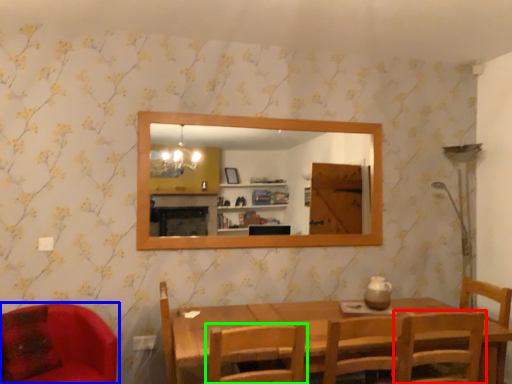
Question: Estimate the real-world distances between objects in this image. Which object is closer to chair (highlighted by a red box), chair (highlighted by a blue box) or chair (highlighted by a green box)?

Choices:
 (A) chair
 (B) chair

Answer: (B)